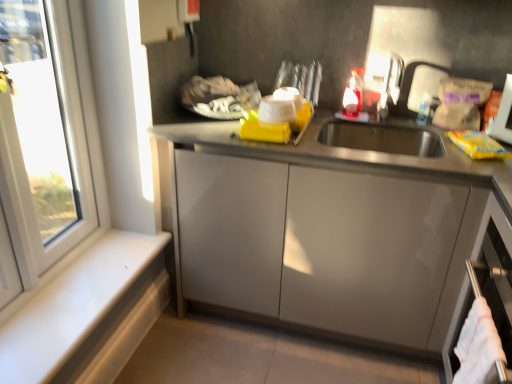
Question: Is satin silver dishwasher at lower right next to white cotton towel at lower right and touching it?

Choices:
 (A) yes
 (B) no

Answer: (B)

Question: From a real-world perspective, is satin silver dishwasher at lower right positioned over white cotton towel at lower right based on gravity?

Choices:
 (A) yes
 (B) no

Answer: (A)

Question: Considering the relative positions of satin silver dishwasher at lower right and white cotton towel at lower right in the image provided, is satin silver dishwasher at lower right to the right of white cotton towel at lower right from the viewer's perspective?

Choices:
 (A) no
 (B) yes

Answer: (B)

Question: Is satin silver dishwasher at lower right smaller than white cotton towel at lower right?

Choices:
 (A) no
 (B) yes

Answer: (A)

Question: Is satin silver dishwasher at lower right to the left of white cotton towel at lower right from the viewer's perspective?

Choices:
 (A) yes
 (B) no

Answer: (B)

Question: Visually, is yellow matte packet at right positioned to the left or to the right of satin nickel faucet at upper right?

Choices:
 (A) left
 (B) right

Answer: (B)

Question: From the image's perspective, relative to satin nickel faucet at upper right, is yellow matte packet at right above or below?

Choices:
 (A) below
 (B) above

Answer: (A)

Question: From a real-world perspective, is yellow matte packet at right above or below satin nickel faucet at upper right?

Choices:
 (A) above
 (B) below

Answer: (B)

Question: Is yellow matte packet at right wider or thinner than satin nickel faucet at upper right?

Choices:
 (A) thin
 (B) wide

Answer: (A)

Question: Is satin nickel faucet at upper right inside or outside of white matte window sill at lower left?

Choices:
 (A) outside
 (B) inside

Answer: (A)

Question: Visually, is satin nickel faucet at upper right positioned to the left or to the right of white matte window sill at lower left?

Choices:
 (A) right
 (B) left

Answer: (A)

Question: From the image's perspective, is satin nickel faucet at upper right positioned above or below white matte window sill at lower left?

Choices:
 (A) below
 (B) above

Answer: (B)

Question: Is point (394, 59) closer or farther from the camera than point (47, 367)?

Choices:
 (A) farther
 (B) closer

Answer: (A)

Question: Considering the positions of white plastic window at left and satin silver dishwasher at lower right in the image, is white plastic window at left wider or thinner than satin silver dishwasher at lower right?

Choices:
 (A) thin
 (B) wide

Answer: (A)

Question: Considering their positions, is white plastic window at left located in front of or behind satin silver dishwasher at lower right?

Choices:
 (A) front
 (B) behind

Answer: (B)